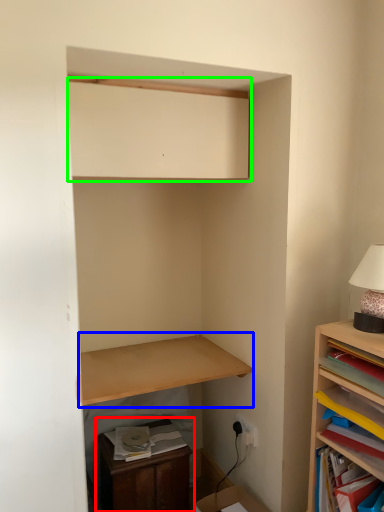
Question: Estimate the real-world distances between objects in this image. Which object is farther from dresser (highlighted by a red box), shelf (highlighted by a blue box) or medicine cabinet (highlighted by a green box)?

Choices:
 (A) shelf
 (B) medicine cabinet

Answer: (B)